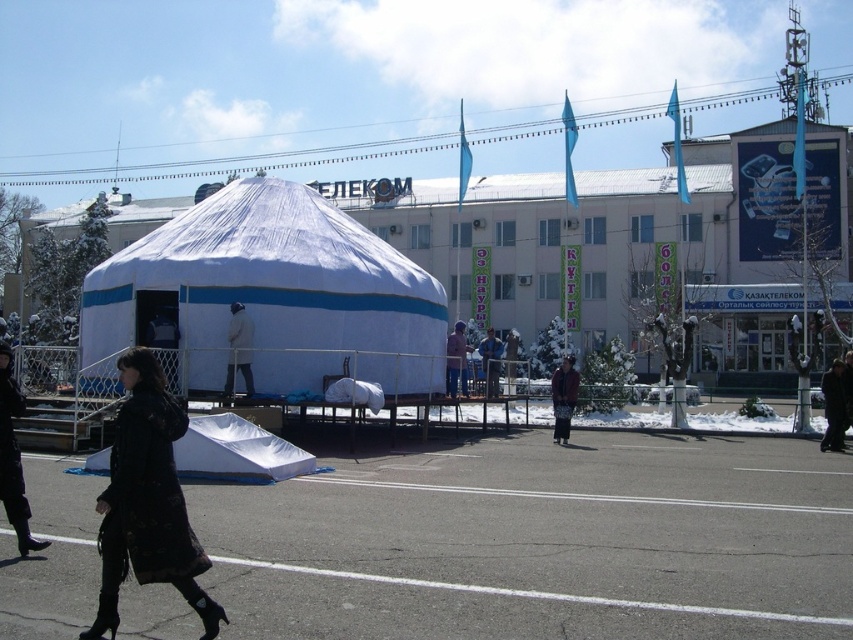
Question: Does white fabric tent at lower center appear on the right side of dark blue fabric tent at center?

Choices:
 (A) no
 (B) yes

Answer: (A)

Question: Does dark brown textured coat at center have a lesser width compared to light brown fabric jacket at center?

Choices:
 (A) yes
 (B) no

Answer: (A)

Question: Can you confirm if black leather coat at lower left is positioned to the left of dark brown textured coat at center?

Choices:
 (A) yes
 (B) no

Answer: (A)

Question: Which point appears farthest from the camera in this image?

Choices:
 (A) (256, 268)
 (B) (199, 476)
 (C) (494, 348)

Answer: (C)

Question: Which object is positioned closest to the light brown fabric jacket at center?

Choices:
 (A) white fabric tent at center
 (B) black leather jacket at lower right
 (C) dark gray fabric jacket at center
 (D) dark blue fabric tent at center

Answer: (D)

Question: Which point is closer to the camera taking this photo?

Choices:
 (A) (833, 419)
 (B) (280, 388)

Answer: (B)